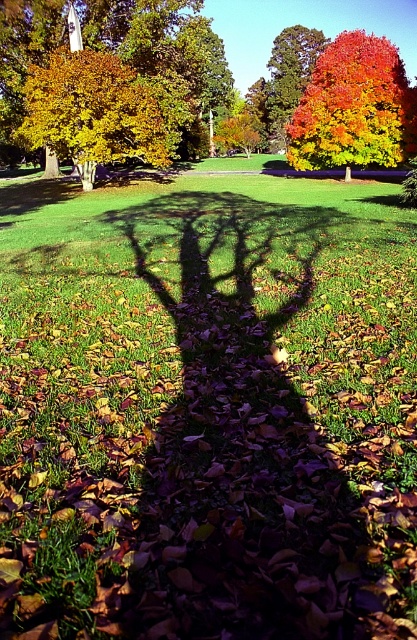
Can you confirm if orange autumn leaves at center is wider than golden yellow leaves at upper left?

Yes.

The height and width of the screenshot is (640, 417). What do you see at coordinates (117, 49) in the screenshot? I see `orange autumn leaves at center` at bounding box center [117, 49].

Identify the location of orange autumn leaves at center. [117, 49].

Does vivid orange maple at upper right have a lesser width compared to golden yellow leaves at upper left?

No.

Is point (404, 99) positioned behind point (92, 120)?

That is True.

Is point (367, 90) positioned in front of point (97, 125)?

No, (367, 90) is further to viewer.

This screenshot has width=417, height=640. I want to click on vivid orange maple at upper right, so click(354, 108).

Is orange autumn leaves at center bigger than vivid orange maple at upper right?

Indeed, orange autumn leaves at center has a larger size compared to vivid orange maple at upper right.

Does point (130, 45) come behind point (331, 52)?

That is False.

Is point (183, 88) in front of point (396, 120)?

No, (183, 88) is behind (396, 120).

Where is `orange autumn leaves at center`? Image resolution: width=417 pixels, height=640 pixels. orange autumn leaves at center is located at coordinates (117, 49).